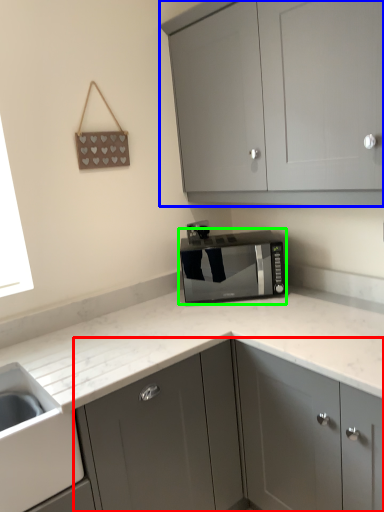
Question: Considering the real-world distances, which object is farthest from cabinetry (highlighted by a red box)? cabinetry (highlighted by a blue box) or home appliance (highlighted by a green box)?

Choices:
 (A) cabinetry
 (B) home appliance

Answer: (A)